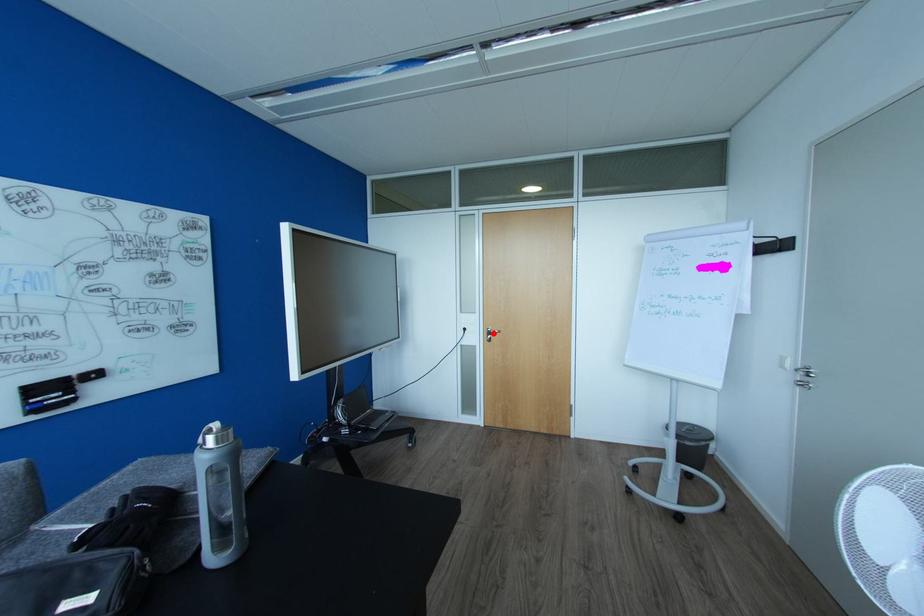
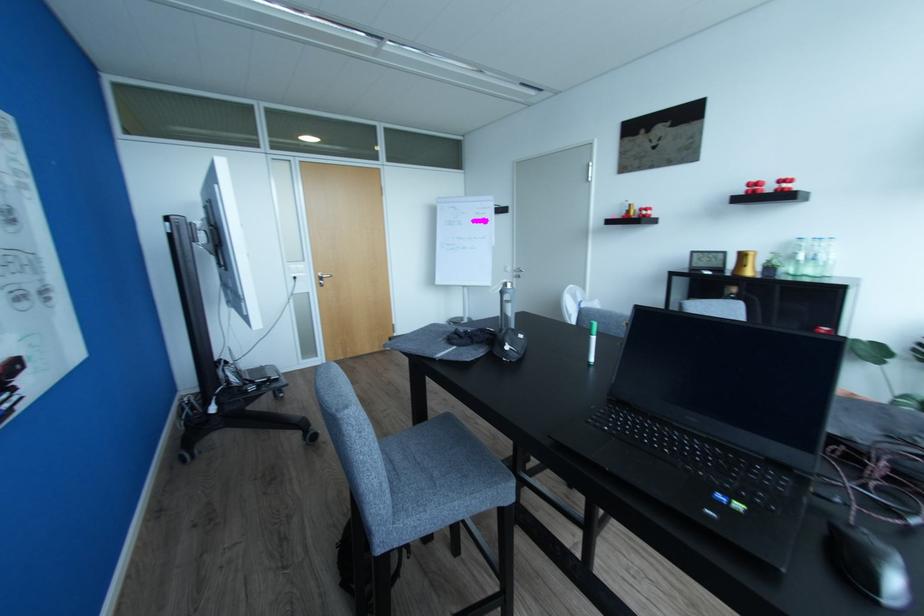
The point at the highlighted location is marked in the first image. Where is the corresponding point in the second image?

(324, 278)